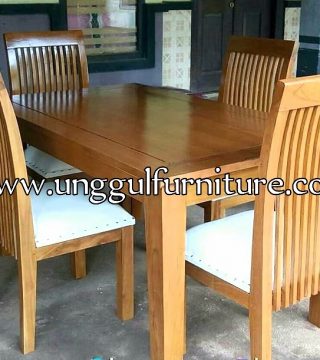
This screenshot has width=320, height=360. Identify the location of knob. (234, 7).